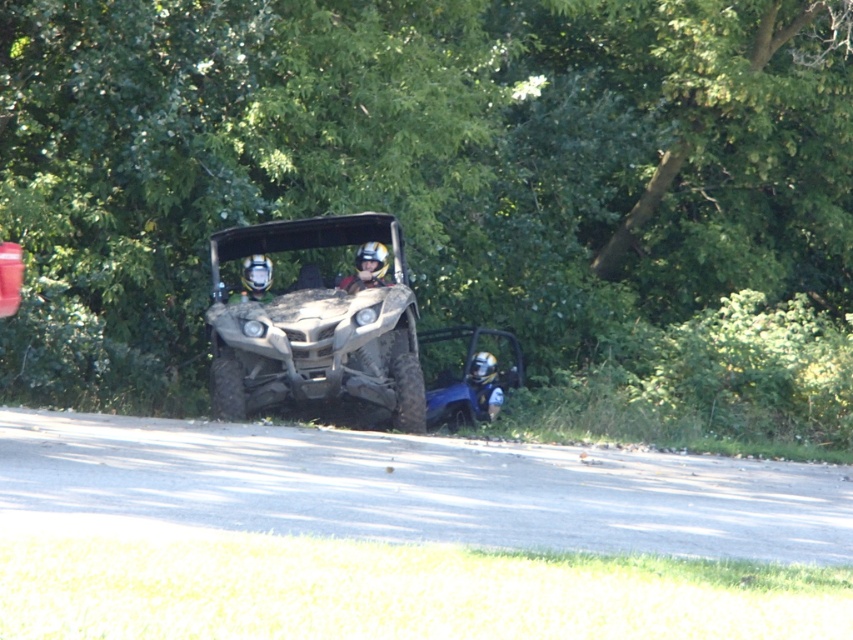
Does green leafy tree at center have a larger size compared to matte black helmet at center?

Yes, green leafy tree at center is bigger than matte black helmet at center.

Who is shorter, green leafy tree at center or matte black helmet at center?

matte black helmet at center is shorter.

Is point (822, 76) more distant than point (263, 289)?

Yes, it is behind point (263, 289).

Where is `green leafy tree at center`? Image resolution: width=853 pixels, height=640 pixels. green leafy tree at center is located at coordinates (415, 163).

Is matte yellow helmet at center in front of matte black helmet at center?

Yes.

Between matte yellow helmet at center and matte black helmet at center, which one has more height?

matte yellow helmet at center

Is point (376, 250) positioned after point (265, 257)?

That is False.

Identify the location of matte yellow helmet at center. The width and height of the screenshot is (853, 640). (367, 268).

Does point (61, 70) come farther from viewer compared to point (492, 381)?

No.

What do you see at coordinates (415, 163) in the screenshot? I see `green leafy tree at center` at bounding box center [415, 163].

You are a GUI agent. You are given a task and a screenshot of the screen. Output one action in this format:
    pyautogui.click(x=<x>, y=<y>)
    Task: Click on the green leafy tree at center
    The width and height of the screenshot is (853, 640).
    Given the screenshot: What is the action you would take?
    pyautogui.click(x=415, y=163)